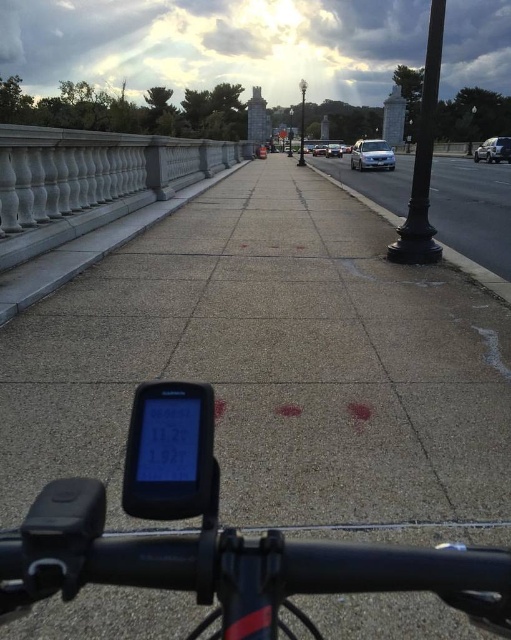
Question: Considering the real-world distances, which object is farthest from the silver metallic sedan at upper right?

Choices:
 (A) black metal pole at right
 (B) silver metallic sedan at center

Answer: (A)

Question: Does black matte bicycle handlebar at lower center appear on the left side of black metal pole at center?

Choices:
 (A) yes
 (B) no

Answer: (A)

Question: Which of the following is the farthest from the observer?

Choices:
 (A) gray concrete sidewalk at right
 (B) black matte bicycle handlebar at lower center
 (C) silver metallic sedan at center

Answer: (C)

Question: Which point is closer to the camera?

Choices:
 (A) black metal pole at center
 (B) satin silver sedan at upper right

Answer: (B)

Question: Can you confirm if gray concrete sidewalk at right is positioned above silver metallic sedan at upper right?

Choices:
 (A) yes
 (B) no

Answer: (B)

Question: Is black matte bicycle handlebar at lower center bigger than gray concrete sidewalk at right?

Choices:
 (A) no
 (B) yes

Answer: (A)